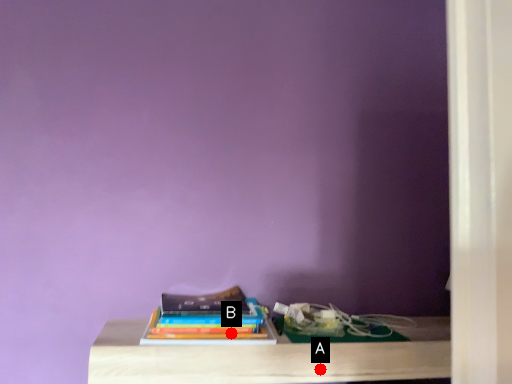
Question: Two points are circled on the image, labeled by A and B beside each circle. Which point is farther to the camera?

Choices:
 (A) A is further
 (B) B is further

Answer: (B)